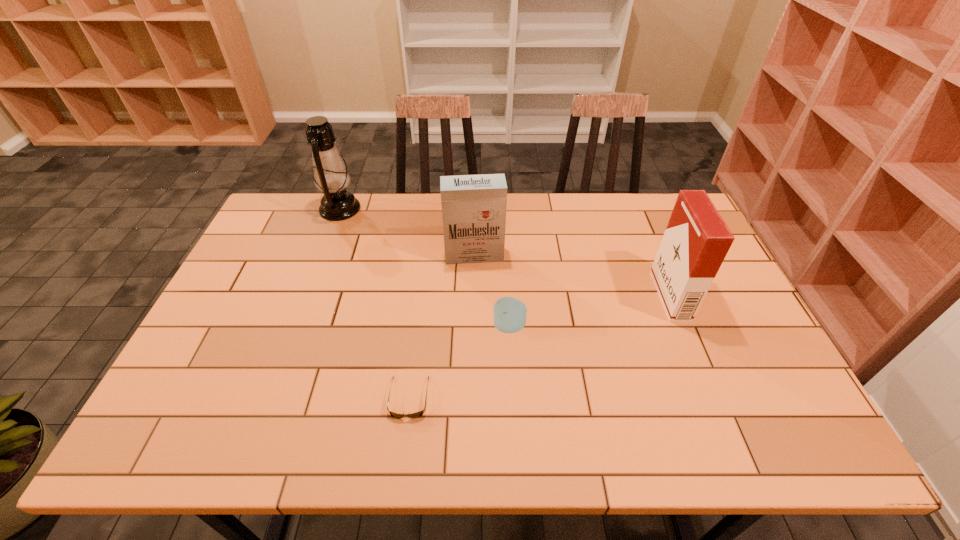
This screenshot has width=960, height=540. What are the coordinates of `free region located on the front-facing side of the rightmost object` in the screenshot? It's located at (592, 296).

This screenshot has width=960, height=540. In order to click on blank area located on the front-facing side of the rightmost object in this screenshot , I will do `click(613, 296)`.

Where is `vacant space situated 0.360m on the front-facing side of the rightmost object`? The width and height of the screenshot is (960, 540). vacant space situated 0.360m on the front-facing side of the rightmost object is located at coordinates (534, 296).

Where is `free space located on the right of the fourth nearest object`? Image resolution: width=960 pixels, height=540 pixels. free space located on the right of the fourth nearest object is located at coordinates (631, 255).

At what (x,y) coordinates should I click in order to perform the action: click on vacant region located 0.180m on the back of the apple. Please return your answer as a coordinate pair (x, y). The height and width of the screenshot is (540, 960). Looking at the image, I should click on (506, 268).

Locate an element on the screen. The image size is (960, 540). vacant space located on the front-facing side of the nearest object is located at coordinates (403, 441).

The width and height of the screenshot is (960, 540). Find the location of `object present at the far edge`. object present at the far edge is located at coordinates (330, 174).

Find the location of a particular element. The height and width of the screenshot is (540, 960). object located in the near edge section of the desktop is located at coordinates (418, 414).

Identify the location of object present at the left edge. click(330, 174).

At what (x,y) coordinates should I click in order to perform the action: click on object that is at the right edge. Please return your answer as a coordinate pair (x, y). The height and width of the screenshot is (540, 960). Looking at the image, I should click on (696, 241).